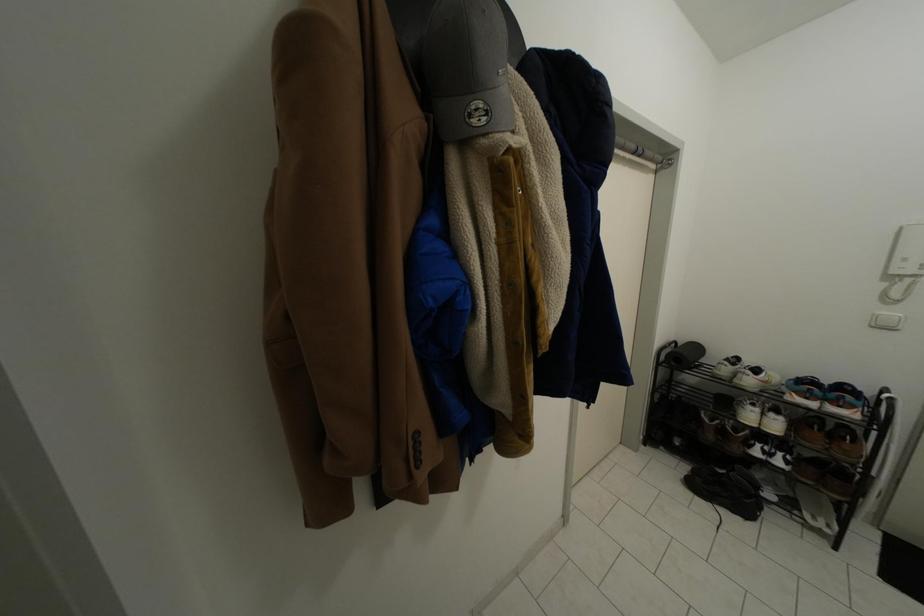
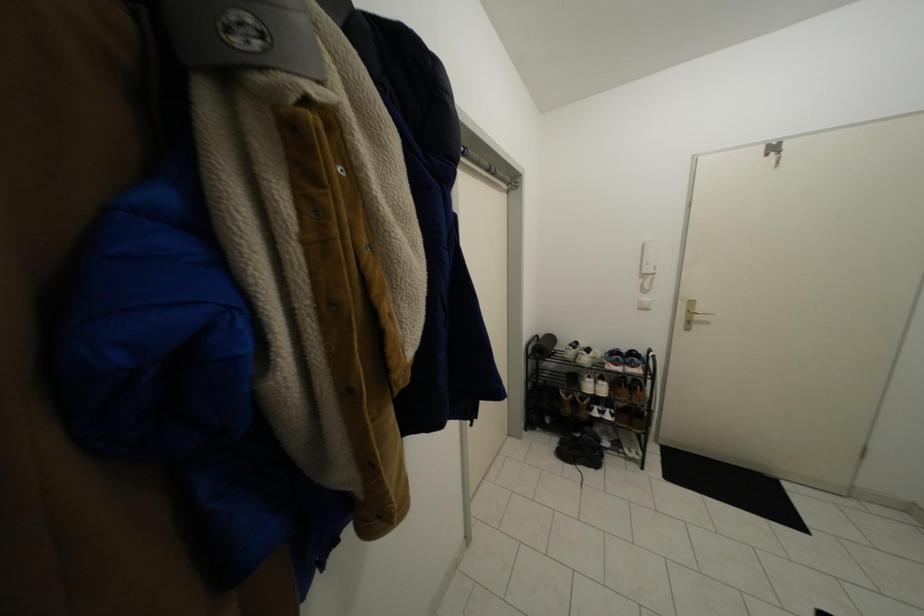
In a continuous first-person perspective shot, in which direction is the camera moving?

The movement direction of the cameraman is right, forward.